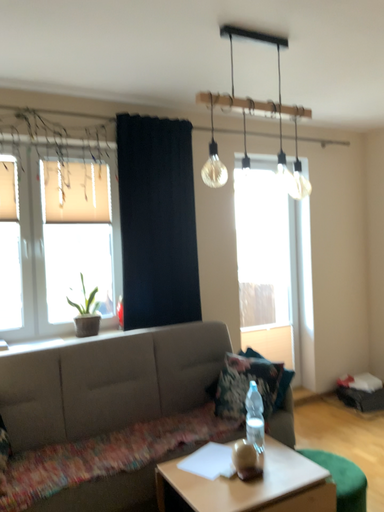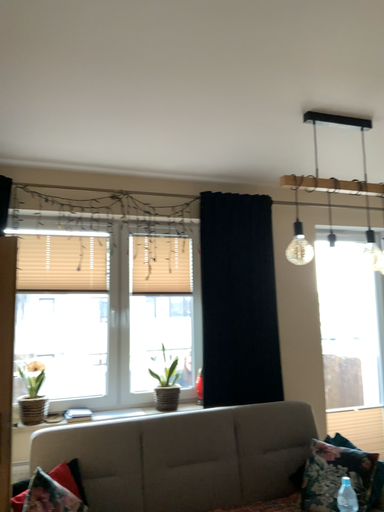
Question: How did the camera likely rotate when shooting the video?

Choices:
 (A) rotated downward
 (B) rotated upward

Answer: (B)